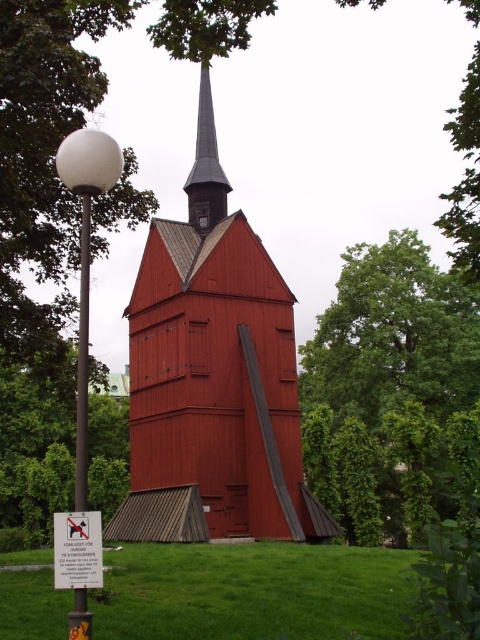
Who is more distant from viewer, (78, 484) or (84, 387)?

Positioned behind is point (84, 387).

Does white glossy ball at left appear over white plastic pole at left?

Yes.

Consider the image. Who is more forward, [82,492] or [83,268]?

Point [82,492] is more forward.

Where is `white glossy ball at left`? This screenshot has height=640, width=480. white glossy ball at left is located at coordinates (85, 256).

Is green leafy tree at upper right to the right of white glossy ball at left from the viewer's perspective?

Indeed, green leafy tree at upper right is positioned on the right side of white glossy ball at left.

Is point (397, 243) positioned after point (63, 138)?

Yes, it is.

At what (x,y) coordinates should I click in order to perform the action: click on green leafy tree at upper right. Please return your answer as a coordinate pair (x, y). The height and width of the screenshot is (640, 480). Looking at the image, I should click on (394, 336).

Does white plastic pole at left appear on the right side of white plastic sign at lower left?

Incorrect, white plastic pole at left is not on the right side of white plastic sign at lower left.

Does white plastic pole at left have a lesser width compared to white plastic sign at lower left?

Incorrect, white plastic pole at left's width is not less than white plastic sign at lower left's.

Where is `white plastic pole at left`? white plastic pole at left is located at coordinates (83, 360).

Find the location of a particular element. This screenshot has height=640, width=480. white plastic pole at left is located at coordinates (83, 360).